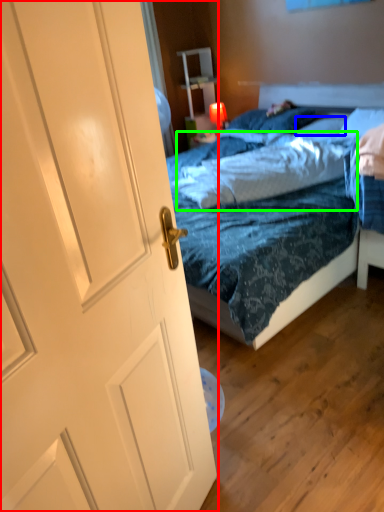
Question: Which object is positioned farthest from door (highlighted by a red box)? Select from pillow (highlighted by a blue box) and sheet (highlighted by a green box).

Choices:
 (A) pillow
 (B) sheet

Answer: (A)